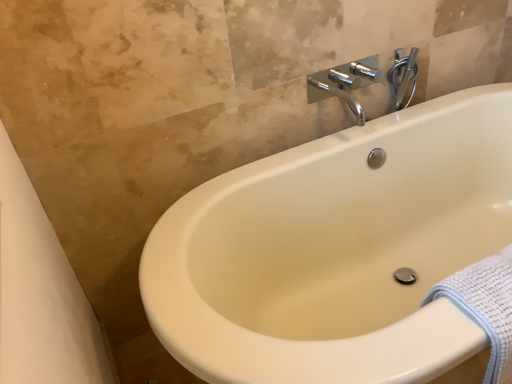
Question: From the image's perspective, is chrome metallic faucet at upper center under chrome metallic faucet at upper right?

Choices:
 (A) yes
 (B) no

Answer: (A)

Question: Does chrome metallic faucet at upper center appear on the right side of chrome metallic faucet at upper right?

Choices:
 (A) yes
 (B) no

Answer: (B)

Question: Considering the relative sizes of chrome metallic faucet at upper center and chrome metallic faucet at upper right in the image provided, is chrome metallic faucet at upper center bigger than chrome metallic faucet at upper right?

Choices:
 (A) no
 (B) yes

Answer: (B)

Question: From the image's perspective, is chrome metallic faucet at upper center on chrome metallic faucet at upper right?

Choices:
 (A) yes
 (B) no

Answer: (B)

Question: Considering the relative positions of chrome metallic faucet at upper center and chrome metallic faucet at upper right in the image provided, is chrome metallic faucet at upper center to the left of chrome metallic faucet at upper right from the viewer's perspective?

Choices:
 (A) no
 (B) yes

Answer: (B)

Question: Relative to chrome metallic faucet at upper center, is chrome metallic faucet at upper right in front or behind?

Choices:
 (A) front
 (B) behind

Answer: (B)

Question: Is point (409, 71) closer or farther from the camera than point (399, 64)?

Choices:
 (A) farther
 (B) closer

Answer: (A)

Question: From a real-world perspective, is chrome metallic faucet at upper right physically located above or below chrome metallic faucet at upper center?

Choices:
 (A) above
 (B) below

Answer: (A)

Question: Would you say chrome metallic faucet at upper right is inside or outside chrome metallic faucet at upper center?

Choices:
 (A) inside
 (B) outside

Answer: (A)

Question: Is chrome metallic faucet at upper center spatially inside chrome metallic faucet at upper right, or outside of it?

Choices:
 (A) inside
 (B) outside

Answer: (B)

Question: Considering the positions of chrome metallic faucet at upper center and chrome metallic faucet at upper right in the image, is chrome metallic faucet at upper center wider or thinner than chrome metallic faucet at upper right?

Choices:
 (A) thin
 (B) wide

Answer: (B)

Question: Is point (333, 79) closer or farther from the camera than point (399, 56)?

Choices:
 (A) farther
 (B) closer

Answer: (B)

Question: From a real-world perspective, relative to chrome metallic faucet at upper right, is chrome metallic faucet at upper center vertically above or below?

Choices:
 (A) above
 (B) below

Answer: (B)

Question: Considering the positions of point (407, 64) and point (499, 264), is point (407, 64) closer or farther from the camera than point (499, 264)?

Choices:
 (A) farther
 (B) closer

Answer: (A)

Question: In terms of size, does chrome metallic faucet at upper center appear bigger or smaller than white textured towel at lower right?

Choices:
 (A) small
 (B) big

Answer: (B)